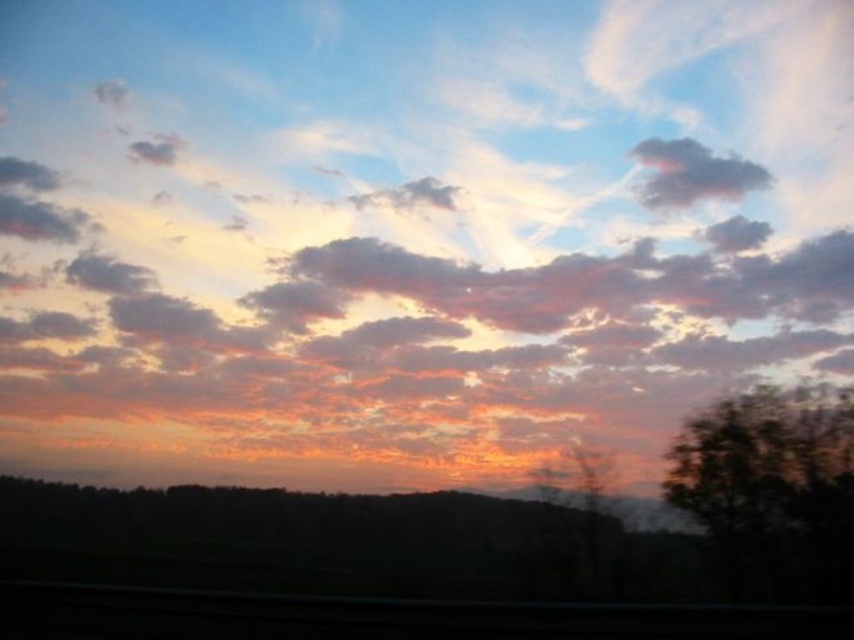
You are an artist trying to paint the sunset scene. You want to ensure the proportions of the dark green leafy tree at right and the dark gray fluffy cloud at upper center are accurate. Which object should you paint as taller?

The dark green leafy tree at right should be painted as taller because it is taller than the dark gray fluffy cloud at upper center according to the description.

You are an artist trying to paint the sunset scene. You want to ensure the dark green leafy tree at right and the dark gray fluffy cloud at upper center are positioned correctly. Which object should you paint first to create the proper layering effect?

You should paint the dark green leafy tree at right first because it is in front of the dark gray fluffy cloud at upper center, so painting it first will allow the cloud to be placed behind it properly.

You are an astronomer observing the sunset. You notice the dark green leafy tree at right and the dark gray fluffy cloud at upper center. Which object is positioned higher in the sky?

The dark gray fluffy cloud at upper center is positioned higher in the sky than the dark green leafy tree at right.